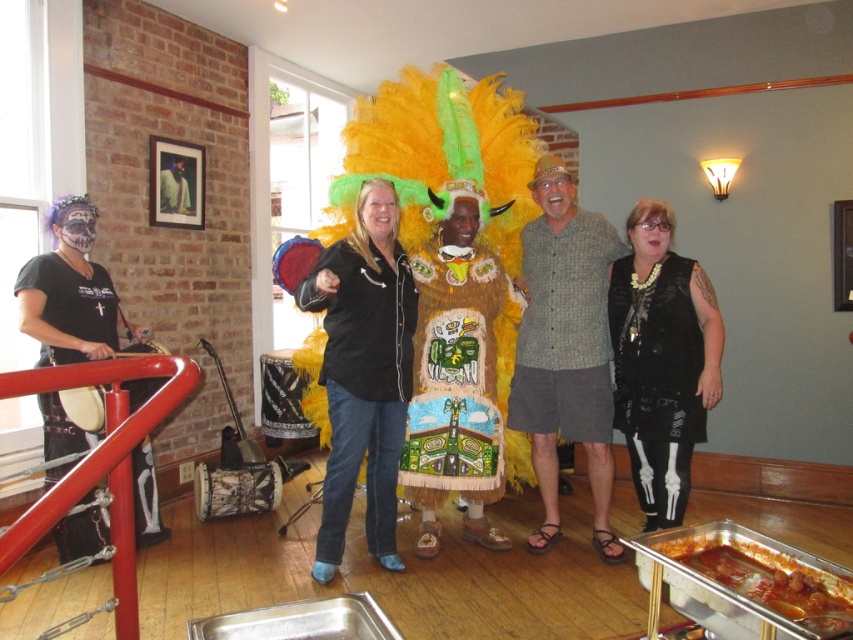
Question: Which point is closer to the camera?

Choices:
 (A) (577, 326)
 (B) (709, 289)
 (C) (383, 480)

Answer: (B)

Question: Does gray textured shirt at center appear over black velvet vest at center?

Choices:
 (A) yes
 (B) no

Answer: (A)

Question: Is shiny metallic costume at center to the left of black leather drum at left from the viewer's perspective?

Choices:
 (A) no
 (B) yes

Answer: (A)

Question: Which object is farther from the camera taking this photo?

Choices:
 (A) black velvet vest at center
 (B) black leather drum at left
 (C) shiny silver tray at lower right
 (D) shiny metallic costume at center

Answer: (A)

Question: Is gray textured shirt at center bigger than shiny metallic costume at center?

Choices:
 (A) no
 (B) yes

Answer: (A)

Question: Which of the following is the closest to the observer?

Choices:
 (A) black velvet vest at center
 (B) shiny metallic costume at center
 (C) shiny silver tray at lower right
 (D) beige textured fabric at center

Answer: (C)